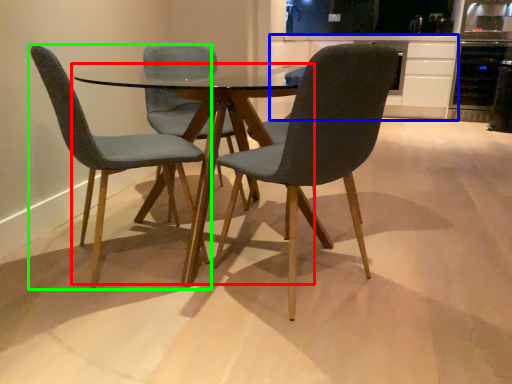
Question: Which object is positioned farthest from coffee table (highlighted by a red box)? Select from cabinetry (highlighted by a blue box) and chair (highlighted by a green box).

Choices:
 (A) cabinetry
 (B) chair

Answer: (A)